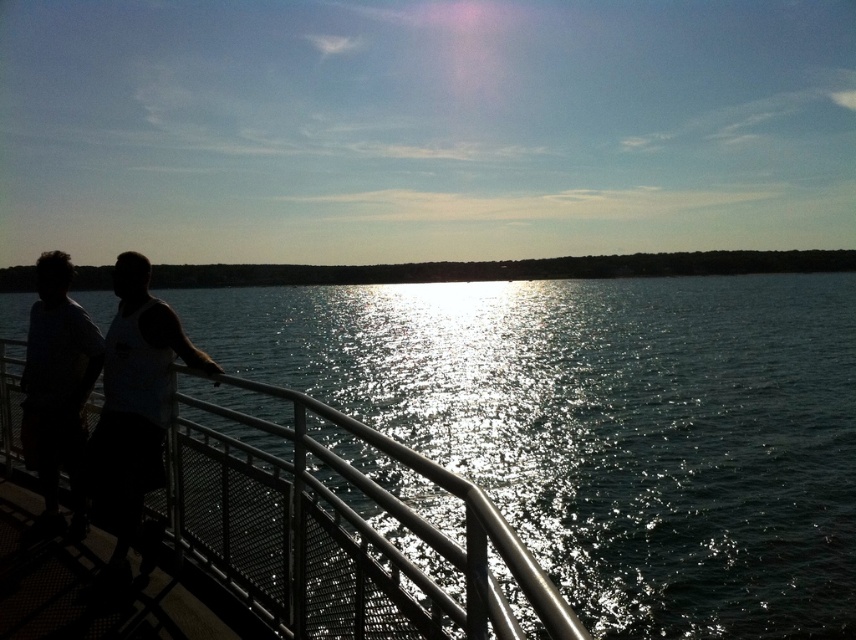
Question: Does black matte tank top at center appear over matte white shirt at left?

Choices:
 (A) yes
 (B) no

Answer: (B)

Question: Estimate the real-world distances between objects in this image. Which object is closer to the metallic silver rail at center?

Choices:
 (A) black matte tank top at center
 (B) matte white shirt at left

Answer: (B)

Question: Does metallic silver rail at center appear under black matte tank top at center?

Choices:
 (A) no
 (B) yes

Answer: (B)

Question: Which of these objects is positioned closest to the matte white shirt at left?

Choices:
 (A) black matte tank top at center
 (B) metallic silver rail at center

Answer: (A)

Question: Which is farther from the metallic silver rail at center?

Choices:
 (A) black matte tank top at center
 (B) matte white shirt at left

Answer: (A)

Question: Is metallic silver rail at center wider than black matte tank top at center?

Choices:
 (A) no
 (B) yes

Answer: (B)